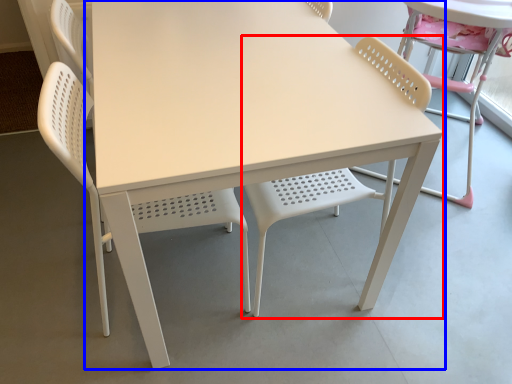
Question: Which of the following is the closest to the observer, chair (highlighted by a red box) or table (highlighted by a blue box)?

Choices:
 (A) chair
 (B) table

Answer: (A)